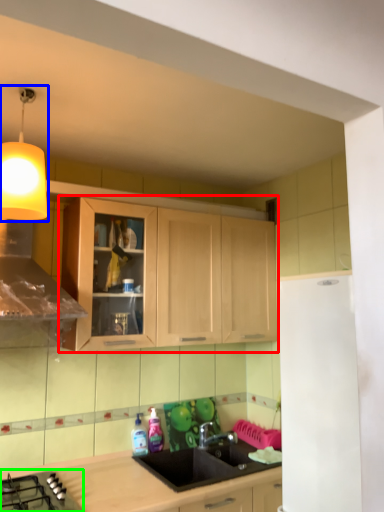
Question: Estimate the real-world distances between objects in this image. Which object is farther from cabinetry (highlighted by a red box), light fixture (highlighted by a blue box) or gas stove (highlighted by a green box)?

Choices:
 (A) light fixture
 (B) gas stove

Answer: (B)